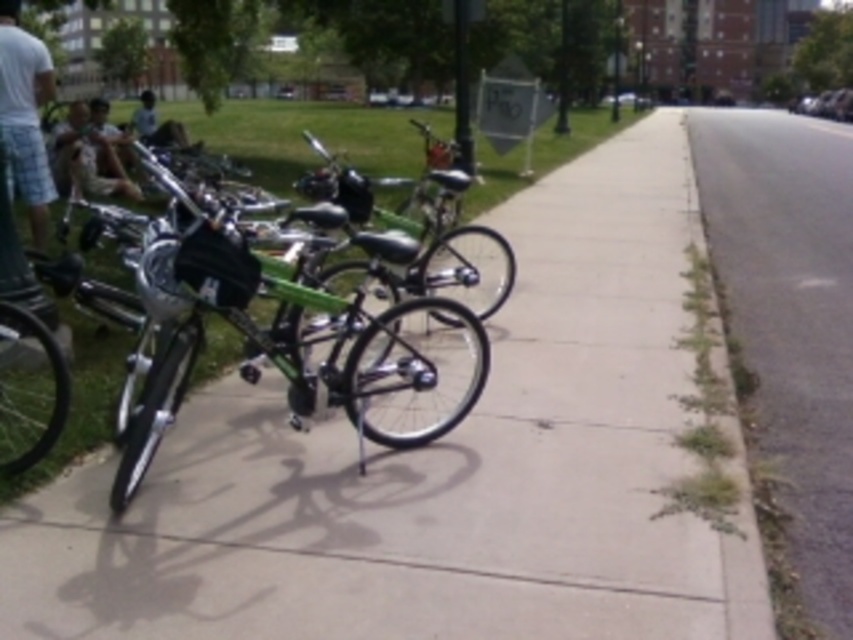
You are standing at the point marked by the coordinates (427, 467) in the image. Based on the scene description, what type of surface are you currently standing on?

The point at coordinates (427, 467) indicates smooth concrete sidewalk at center, so you are standing on a smooth concrete sidewalk.